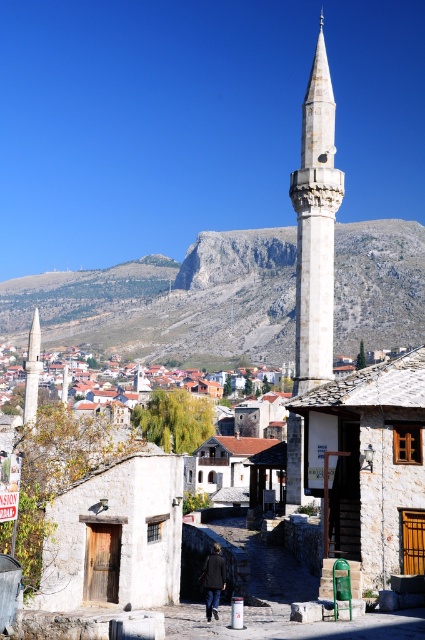
Between white stone minaret at center and white stone minaret at left, which one is positioned higher?

Positioned higher is white stone minaret at center.

In the scene shown: Measure the distance between white stone minaret at center and white stone minaret at left.

The distance of white stone minaret at center from white stone minaret at left is 63.79 meters.

You are a GUI agent. You are given a task and a screenshot of the screen. Output one action in this format:
    pyautogui.click(x=<x>, y=<y>)
    Task: Click on the white stone minaret at center
    
    Given the screenshot: What is the action you would take?
    pyautogui.click(x=316, y=227)

Is rocky gray mountain at upper center thinner than white stone minaret at center?

No.

Consider the image. Can you confirm if rocky gray mountain at upper center is positioned to the left of white stone minaret at center?

Yes, rocky gray mountain at upper center is to the left of white stone minaret at center.

Does point (255, 288) lie behind point (309, 83)?

Yes, point (255, 288) is behind point (309, 83).

Image resolution: width=425 pixels, height=640 pixels. I want to click on rocky gray mountain at upper center, so (x=170, y=301).

Can you confirm if rocky gray mountain at upper center is wider than white stone minaret at left?

Correct, the width of rocky gray mountain at upper center exceeds that of white stone minaret at left.

Is the position of rocky gray mountain at upper center less distant than that of white stone minaret at left?

That is False.

Describe the element at coordinates (170, 301) in the screenshot. I see `rocky gray mountain at upper center` at that location.

Locate an element on the screen. Image resolution: width=425 pixels, height=640 pixels. rocky gray mountain at upper center is located at coordinates (170, 301).